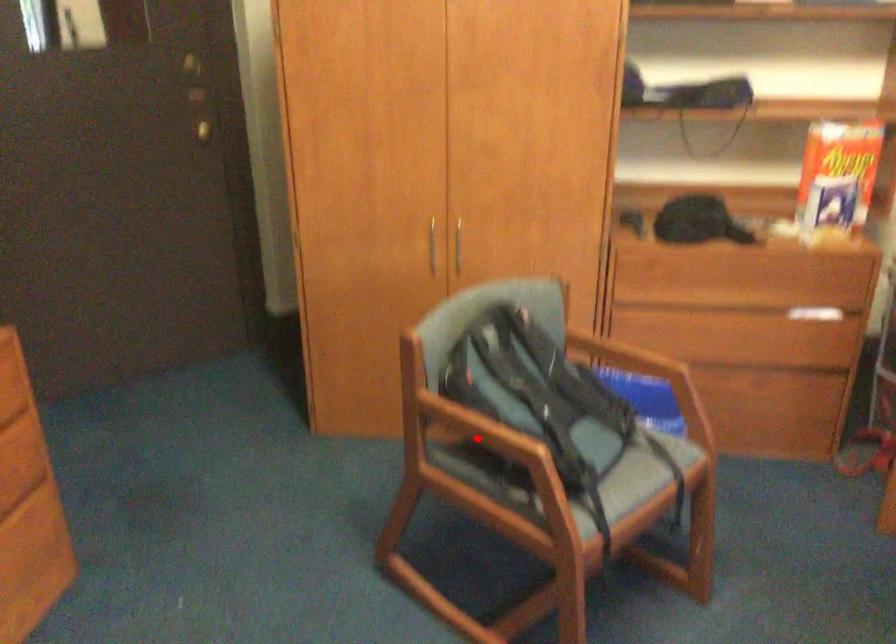
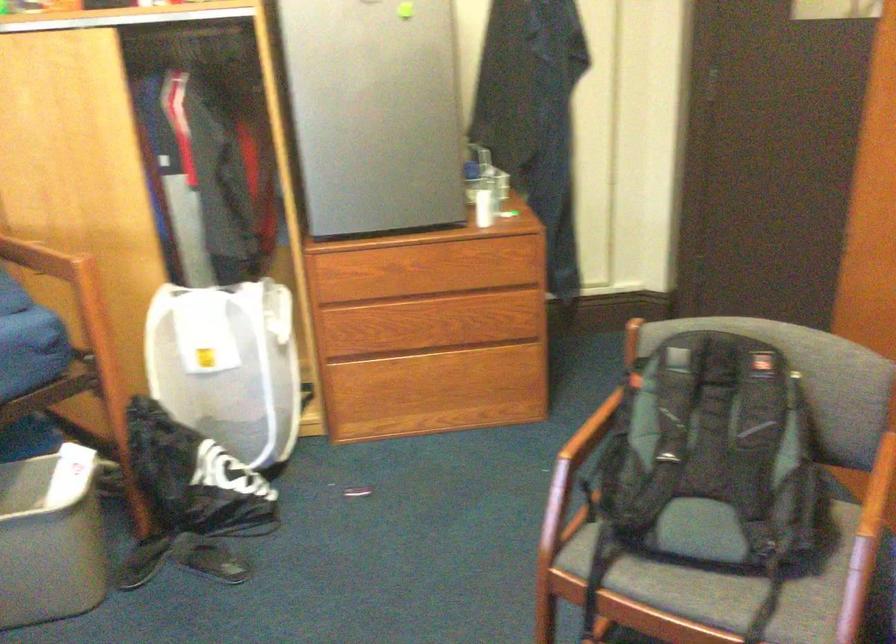
In the second image, find the point that corresponds to the highlighted location in the first image.

(588, 436)